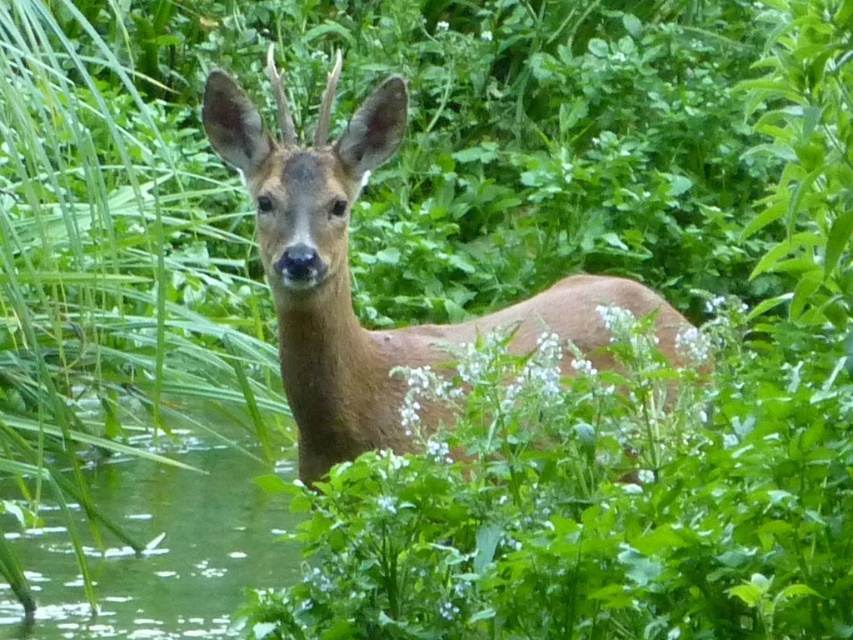
In the scene shown: Is brown matte deer at center to the right of green liquid water at lower left from the viewer's perspective?

Indeed, brown matte deer at center is positioned on the right side of green liquid water at lower left.

Who is positioned more to the left, brown matte deer at center or green liquid water at lower left?

green liquid water at lower left

Does point (561, 339) lie in front of point (125, 634)?

Yes, point (561, 339) is closer to viewer.

The height and width of the screenshot is (640, 853). In order to click on brown matte deer at center in this screenshot , I will do (349, 275).